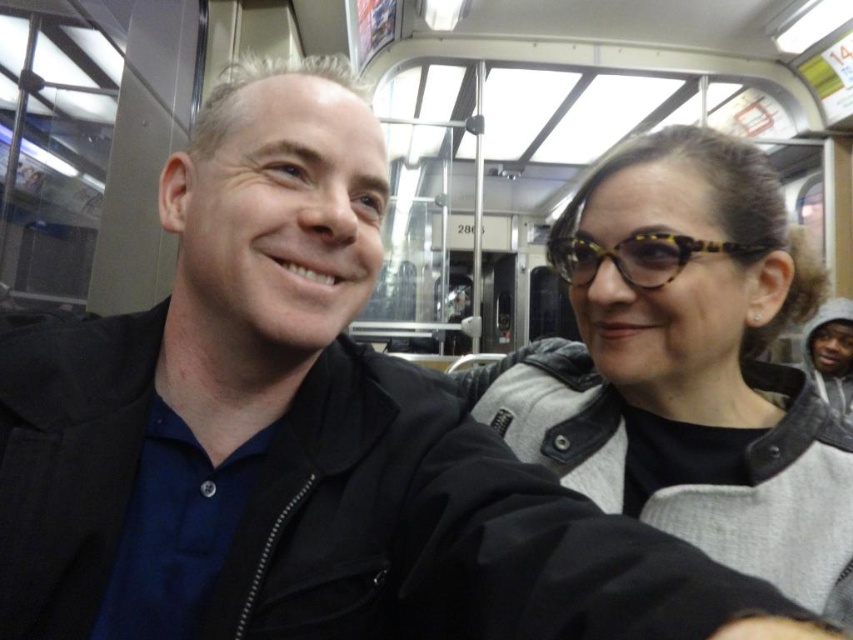
Question: Among these objects, which one is farthest from the camera?

Choices:
 (A) tortoiseshell acetate goggles at upper right
 (B) matte black jacket at center

Answer: (A)

Question: In this image, where is matte black jacket at center located relative to tortoiseshell acetate goggles at upper right?

Choices:
 (A) above
 (B) below

Answer: (B)

Question: Which object appears closest to the camera in this image?

Choices:
 (A) tortoiseshell acetate goggles at upper right
 (B) matte black jacket at center

Answer: (B)

Question: Where is matte black jacket at center located in relation to tortoiseshell acetate goggles at upper right in the image?

Choices:
 (A) above
 (B) below

Answer: (B)

Question: Is matte black jacket at center to the right of tortoiseshell acetate goggles at upper right from the viewer's perspective?

Choices:
 (A) no
 (B) yes

Answer: (B)

Question: Which object appears farthest from the camera in this image?

Choices:
 (A) matte black jacket at center
 (B) tortoiseshell acetate goggles at upper right

Answer: (B)